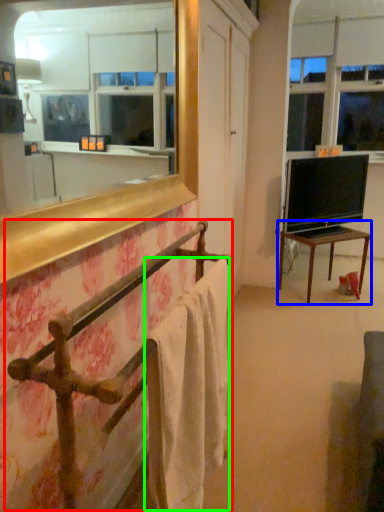
Question: Which is farther away from balustrade (highlighted by a red box)? table (highlighted by a blue box) or bath towel (highlighted by a green box)?

Choices:
 (A) table
 (B) bath towel

Answer: (A)